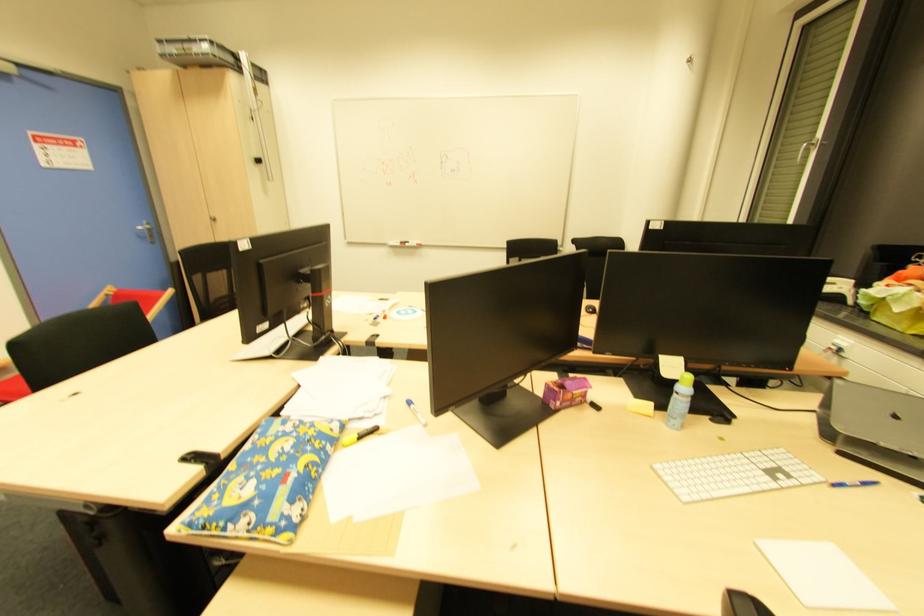
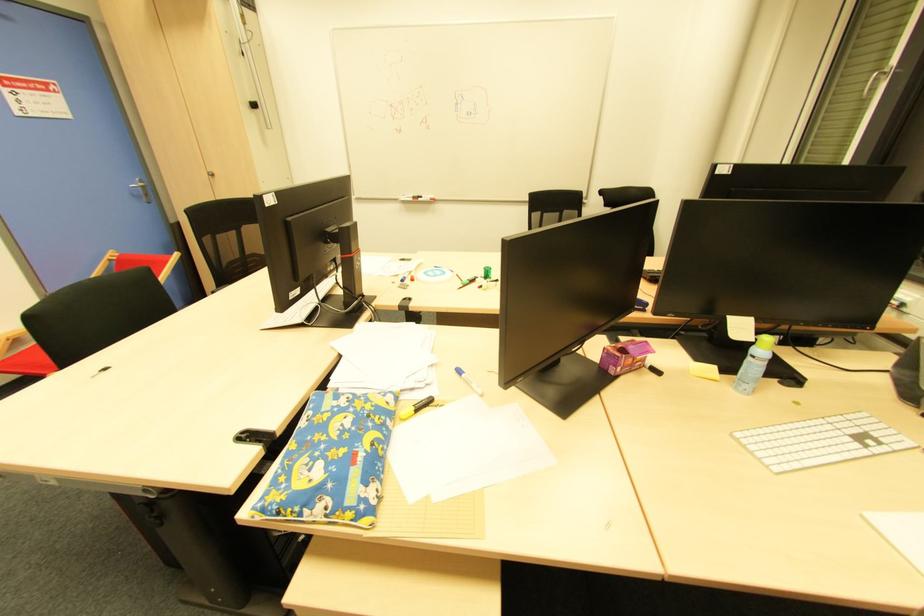
Question: How did the camera likely rotate?

Choices:
 (A) Left
 (B) Right
 (C) Up
 (D) Down

Answer: (D)